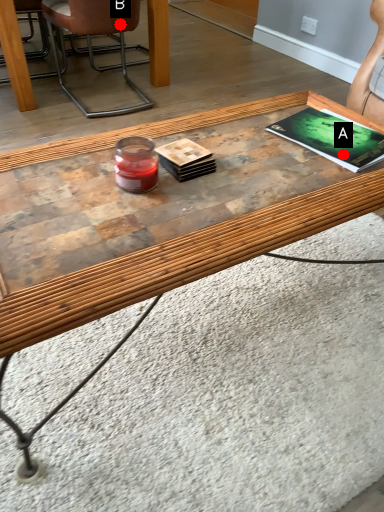
Question: Two points are circled on the image, labeled by A and B beside each circle. Which point appears closest to the camera in this image?

Choices:
 (A) A is closer
 (B) B is closer

Answer: (A)